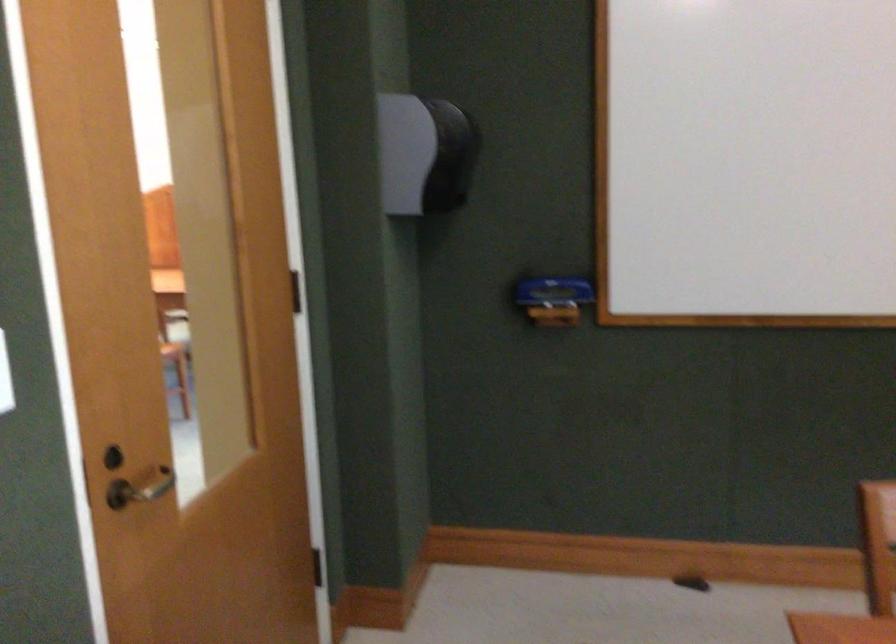
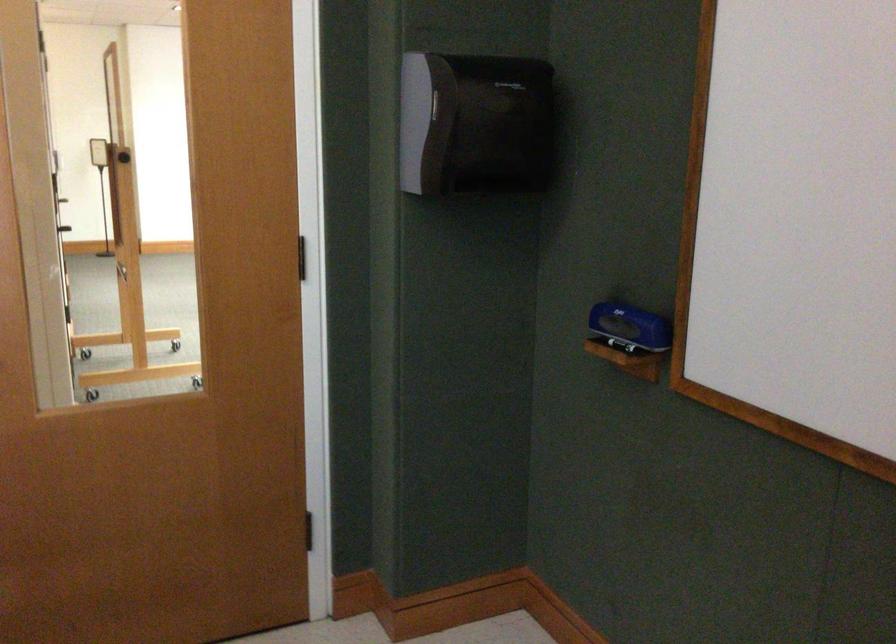
Find the pixel in the second image that matches (461,154) in the first image.

(474, 122)